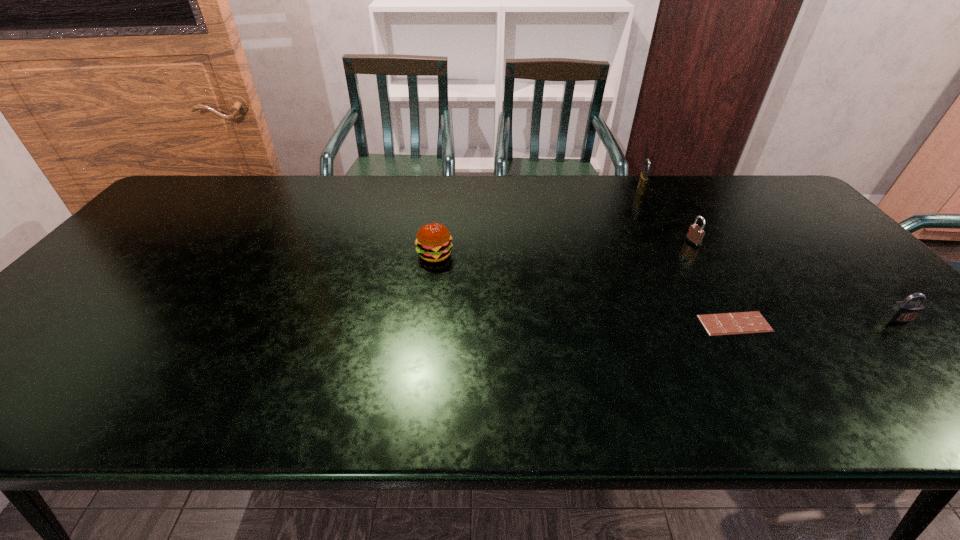
You are a GUI agent. You are given a task and a screenshot of the screen. Output one action in this format:
    pyautogui.click(x=<x>, y=<y>)
    Task: Click on the empty space that is in between the chocolate bar and the hamburger
    The height and width of the screenshot is (540, 960).
    Given the screenshot: What is the action you would take?
    pyautogui.click(x=585, y=289)

Find the location of a particular element. The height and width of the screenshot is (540, 960). free space between the leftmost padlock and the second padlock from right to left is located at coordinates (666, 217).

Where is `free space between the second nearest padlock and the hamburger`? free space between the second nearest padlock and the hamburger is located at coordinates (564, 248).

Identify the location of blank region between the chocolate bar and the rightmost object. The image size is (960, 540). (817, 321).

This screenshot has width=960, height=540. I want to click on free space between the second farthest padlock and the hamburger, so click(564, 248).

Find the location of a particular element. vacant region between the farthest object and the second padlock from right to left is located at coordinates (666, 217).

This screenshot has width=960, height=540. I want to click on blank region between the second farthest padlock and the leftmost object, so click(x=564, y=248).

Find the location of `vacant space in between the second farthest padlock and the farthest padlock`. vacant space in between the second farthest padlock and the farthest padlock is located at coordinates (666, 217).

Where is `unoccupied position between the farthest object and the chocolate bar`? Image resolution: width=960 pixels, height=540 pixels. unoccupied position between the farthest object and the chocolate bar is located at coordinates (687, 257).

Locate an element on the screen. vacant space that's between the hamburger and the tallest padlock is located at coordinates (538, 222).